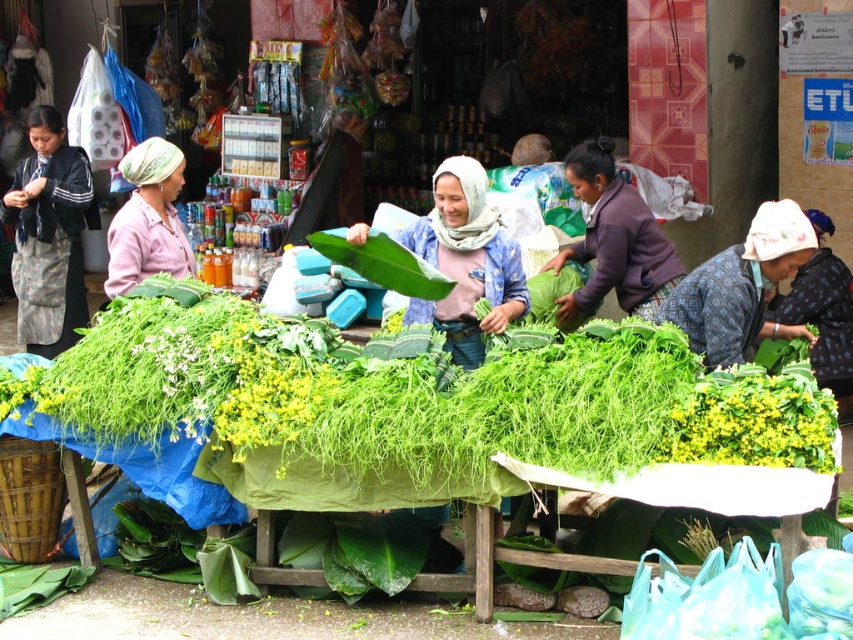
Is green leafy vegetables at center above green leafy at center?

Actually, green leafy vegetables at center is below green leafy at center.

Is green leafy vegetables at center thinner than green leafy at center?

In fact, green leafy vegetables at center might be wider than green leafy at center.

The width and height of the screenshot is (853, 640). Describe the element at coordinates (413, 397) in the screenshot. I see `green leafy vegetables at center` at that location.

Find the location of a particular element. green leafy vegetables at center is located at coordinates (413, 397).

Describe the element at coordinates (383, 262) in the screenshot. I see `green leafy at center` at that location.

Is point (373, 276) positioned after point (579, 285)?

No, it is not.

You are a GUI agent. You are given a task and a screenshot of the screen. Output one action in this format:
    pyautogui.click(x=<x>, y=<y>)
    Task: Click on the green leafy at center
    The image size is (853, 640).
    Given the screenshot: What is the action you would take?
    click(383, 262)

Is green leafy vegetables at center smaller than purple fabric at center?

A: No, green leafy vegetables at center is not smaller than purple fabric at center.

Does green leafy vegetables at center appear on the left side of purple fabric at center?

Indeed, green leafy vegetables at center is positioned on the left side of purple fabric at center.

Who is more forward, (749, 372) or (633, 202)?

Point (749, 372) is in front.

I want to click on green leafy vegetables at center, so click(x=413, y=397).